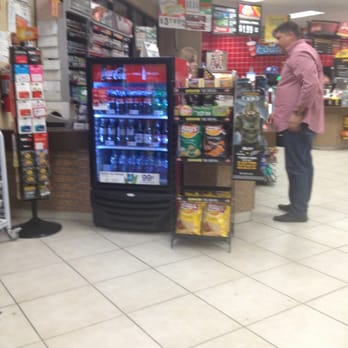
At what (x,y) coordinates should I click in order to perform the action: click on black metal stand. Please return your answer as a coordinate pair (x, y). This screenshot has width=348, height=348. Looking at the image, I should click on (36, 226).